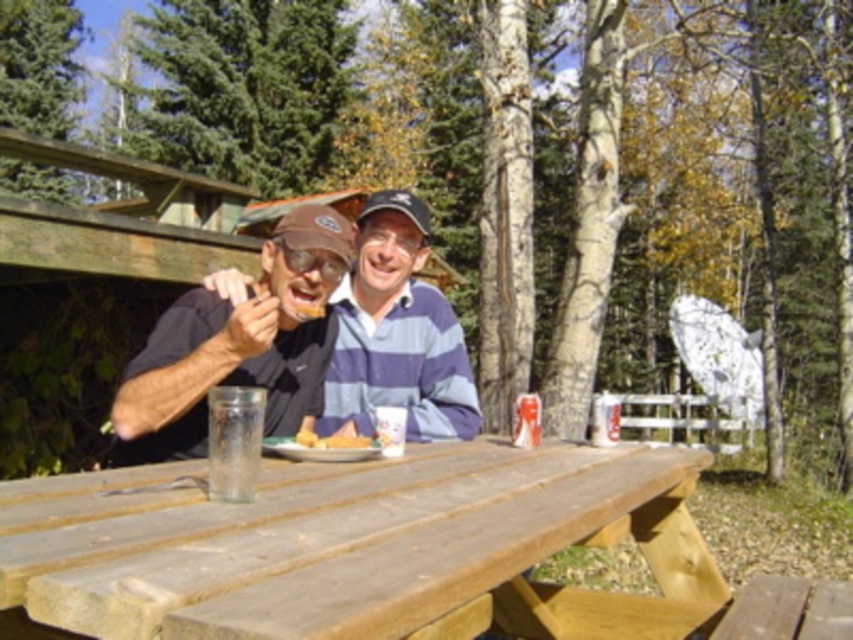
Question: Among these objects, which one is farthest from the camera?

Choices:
 (A) golden fried chicken at center
 (B) wooden picnic table at center
 (C) blue striped shirt at center

Answer: (C)

Question: Which point is farther from the camera taking this photo?

Choices:
 (A) (315, 422)
 (B) (409, 356)

Answer: (B)

Question: Can you confirm if wooden picnic table at center is bigger than matte black shirt at center?

Choices:
 (A) yes
 (B) no

Answer: (A)

Question: Is wooden picnic table at center to the left of blue striped shirt at center from the viewer's perspective?

Choices:
 (A) yes
 (B) no

Answer: (B)

Question: Observing the image, what is the correct spatial positioning of wooden picnic table at center in reference to matte black shirt at center?

Choices:
 (A) left
 (B) right

Answer: (B)

Question: Which of the following is the farthest from the observer?

Choices:
 (A) (387, 310)
 (B) (225, 316)
 (C) (352, 438)
 (D) (213, 595)

Answer: (A)